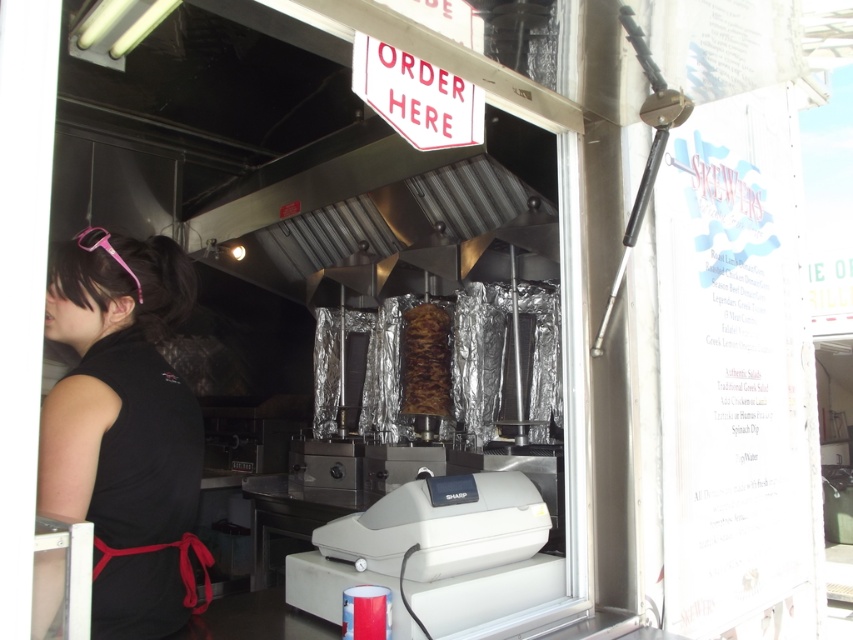
Can you confirm if brown crispy skewer at center is wider than pink plastic goggles at upper left?

Indeed, brown crispy skewer at center has a greater width compared to pink plastic goggles at upper left.

Which of these two, brown crispy skewer at center or pink plastic goggles at upper left, stands shorter?

pink plastic goggles at upper left is shorter.

Which is in front, point (404, 339) or point (80, 237)?

Point (80, 237) is in front.

This screenshot has width=853, height=640. What are the coordinates of `brown crispy skewer at center` in the screenshot? It's located at (424, 362).

Is black fabric apron at left shorter than brown crispy skewer at center?

No, black fabric apron at left is not shorter than brown crispy skewer at center.

Which is more to the right, black fabric apron at left or brown crispy skewer at center?

From the viewer's perspective, brown crispy skewer at center appears more on the right side.

Does point (56, 298) lie in front of point (424, 304)?

That is True.

The width and height of the screenshot is (853, 640). What are the coordinates of `black fabric apron at left` in the screenshot? It's located at (125, 428).

Does black fabric apron at left come behind pink plastic goggles at upper left?

No.

Which is above, black fabric apron at left or pink plastic goggles at upper left?

pink plastic goggles at upper left is above.

What do you see at coordinates (125, 428) in the screenshot? I see `black fabric apron at left` at bounding box center [125, 428].

In order to click on black fabric apron at left in this screenshot , I will do `click(125, 428)`.